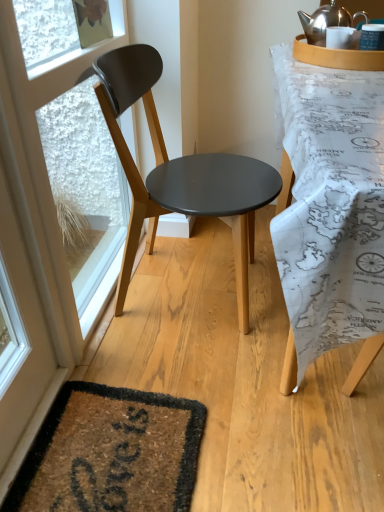
Question: Could you tell me if matte black chair at center is turned towards map-patterned fabric at right?

Choices:
 (A) no
 (B) yes

Answer: (B)

Question: Is matte black chair at center shorter than map-patterned fabric at right?

Choices:
 (A) no
 (B) yes

Answer: (A)

Question: From a real-world perspective, is matte black chair at center below map-patterned fabric at right?

Choices:
 (A) yes
 (B) no

Answer: (B)

Question: Is matte black chair at center to the right of map-patterned fabric at right from the viewer's perspective?

Choices:
 (A) no
 (B) yes

Answer: (A)

Question: Is the position of matte black chair at center less distant than that of map-patterned fabric at right?

Choices:
 (A) yes
 (B) no

Answer: (B)

Question: Is matte black chair at center turned away from map-patterned fabric at right?

Choices:
 (A) yes
 (B) no

Answer: (B)

Question: From a real-world perspective, is polished silver kettle at upper right on top of matte black chair at center?

Choices:
 (A) yes
 (B) no

Answer: (A)

Question: Is polished silver kettle at upper right next to matte black chair at center?

Choices:
 (A) no
 (B) yes

Answer: (A)

Question: Considering the relative sizes of polished silver kettle at upper right and matte black chair at center in the image provided, is polished silver kettle at upper right taller than matte black chair at center?

Choices:
 (A) yes
 (B) no

Answer: (B)

Question: Does polished silver kettle at upper right appear on the right side of matte black chair at center?

Choices:
 (A) no
 (B) yes

Answer: (B)

Question: Can we say polished silver kettle at upper right lies outside matte black chair at center?

Choices:
 (A) yes
 (B) no

Answer: (A)

Question: Does polished silver kettle at upper right have a lesser height compared to matte black chair at center?

Choices:
 (A) yes
 (B) no

Answer: (A)

Question: Would you say matte black chair at center is part of white plastic window frame at left's contents?

Choices:
 (A) yes
 (B) no

Answer: (B)